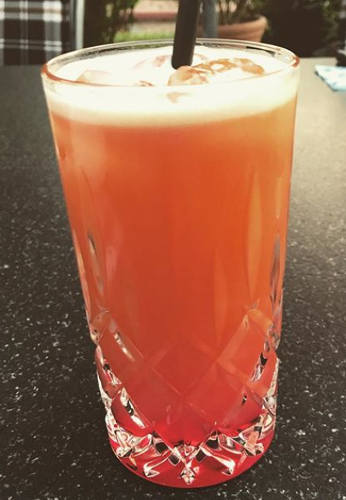
I want to click on glass, so click(223, 271).